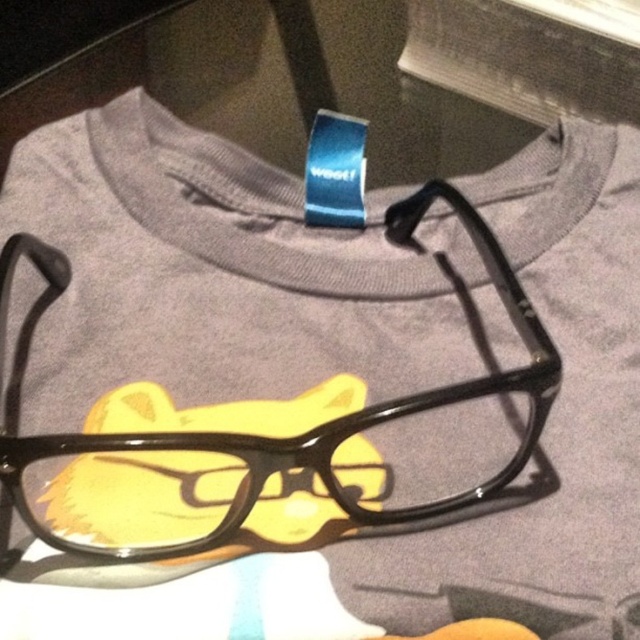
Question: Among these points, which one is nearest to the camera?

Choices:
 (A) (120, 509)
 (B) (234, 509)

Answer: (B)

Question: Does black shiny glasses at center appear on the right side of yellow plush cat at center?

Choices:
 (A) no
 (B) yes

Answer: (B)

Question: Which object is closer to the camera taking this photo?

Choices:
 (A) yellow plush cat at center
 (B) black shiny glasses at center

Answer: (B)

Question: Is black shiny glasses at center in front of yellow plush cat at center?

Choices:
 (A) yes
 (B) no

Answer: (A)

Question: Does black shiny glasses at center appear over yellow plush cat at center?

Choices:
 (A) no
 (B) yes

Answer: (B)